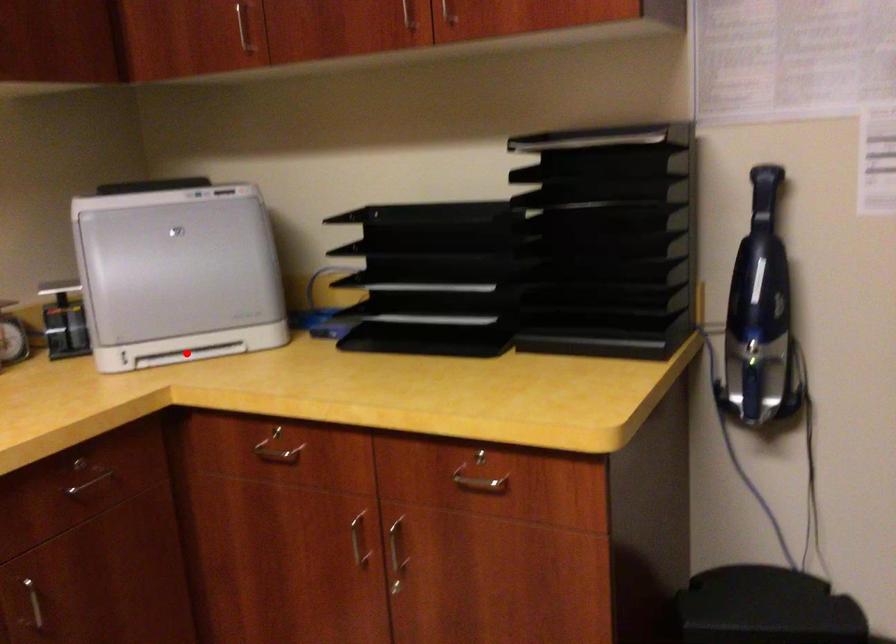
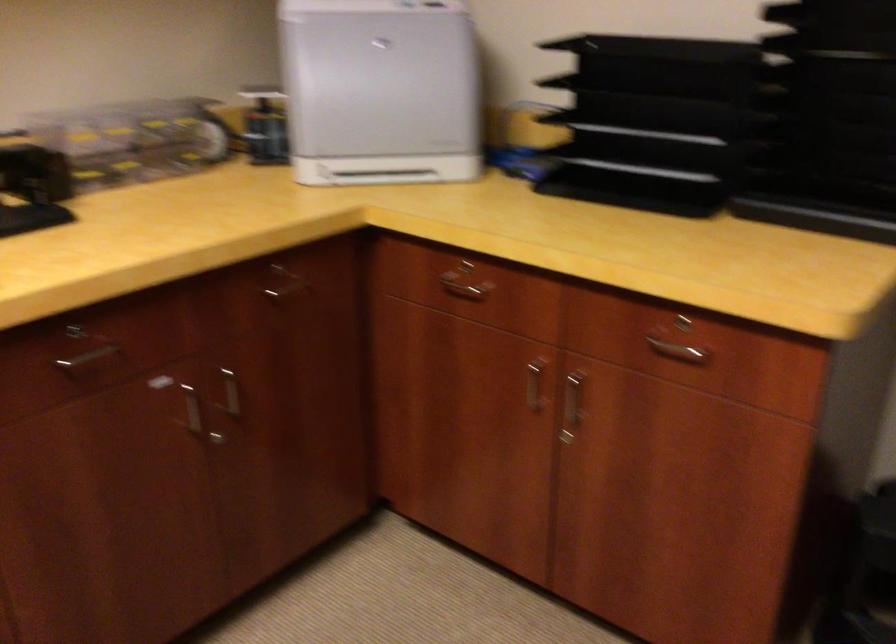
Find the pixel in the second image that matches the highlighted location in the first image.

(380, 176)